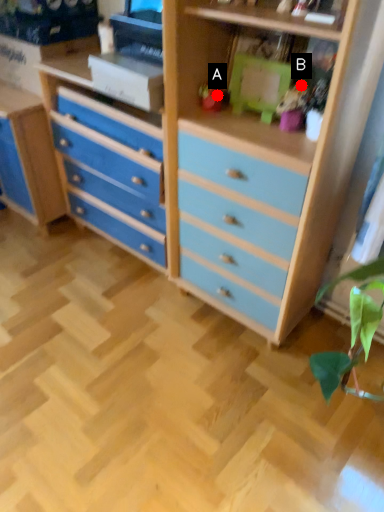
Question: Two points are circled on the image, labeled by A and B beside each circle. Which of the following is the farthest from the observer?

Choices:
 (A) A is further
 (B) B is further

Answer: (A)